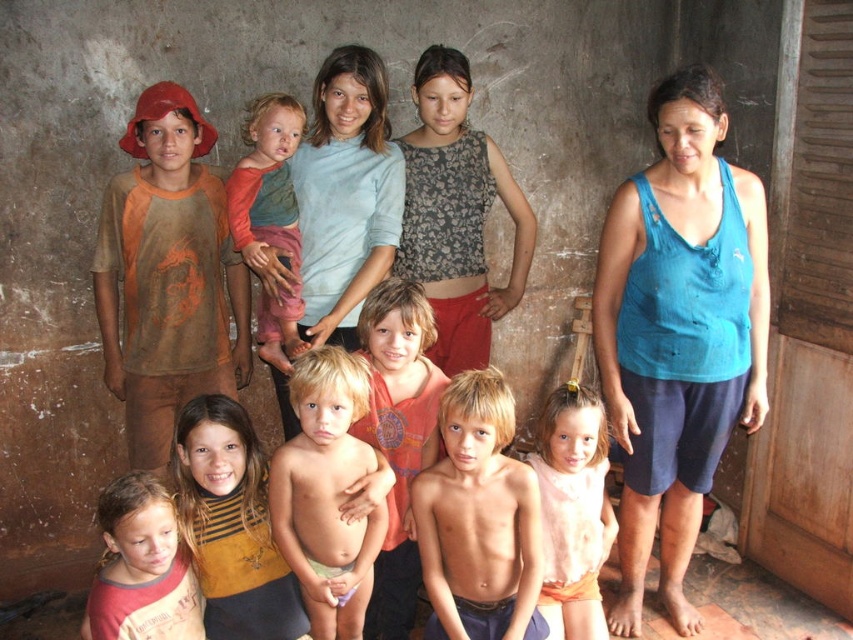
You are standing at the origin point in the image. There is an orange cotton shirt at center. Can you tell me what is located at the point with coordinates (398, 436)?

The orange cotton shirt at center is located at point (398, 436).